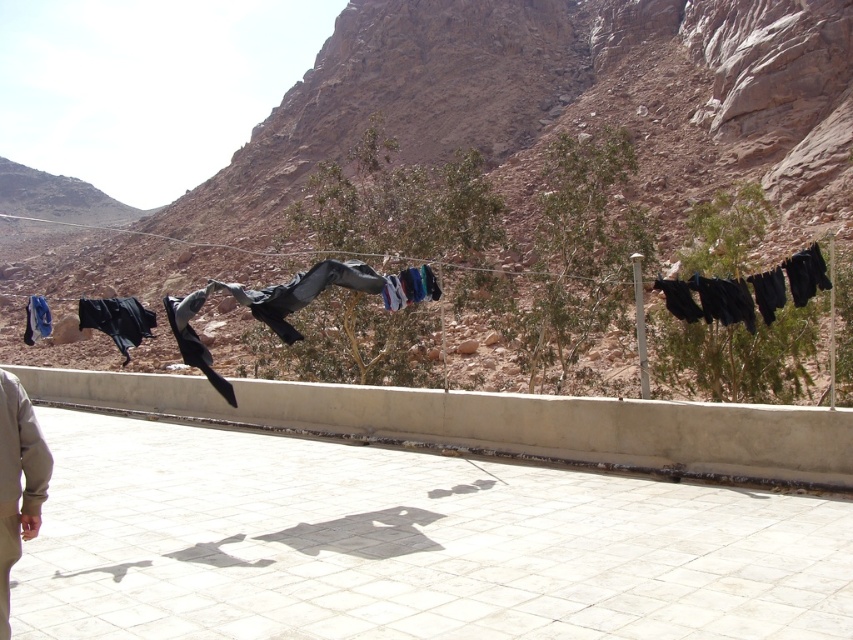
You are organizing a charity clothing drive and need to pack these pants into boxes. The beige cotton pants at lower left and the black matte pants at center are the only ones available. If the box can only fit one pair of pants, which pair should you choose based on their size?

The beige cotton pants at lower left is smaller than the black matte pants at center, so you should choose the beige cotton pants at lower left to fit into the box.

You are standing on the paved area and want to hang a new piece of clothing on the clothesline. The new item is 1.2 meters wide. Which of the two existing items, the black matte cloth at left or the blue fabric at left, has enough space to accommodate the new item without overlapping?

The blue fabric at left has a width greater than the black matte cloth at left. Since the new item is 1.2 meters wide, the blue fabric at left likely provides more space and can accommodate the new item without overlapping.

You are organizing a charity clothing drive and need to sort the beige cotton pants at lower left and black matte pants at center by length. Which pair should you place in the box labeled for shorter pants?

The beige cotton pants at lower left should be placed in the box labeled for shorter pants since they are shorter than the black matte pants at center.